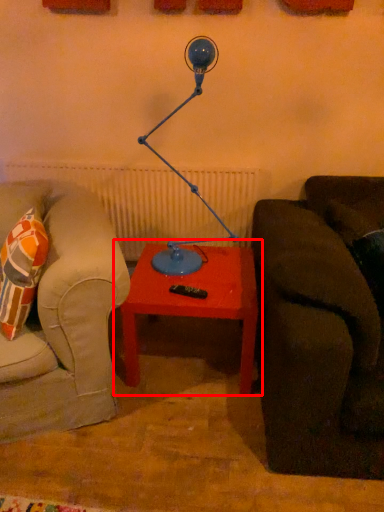
Question: From the image's perspective, considering the relative positions of table (annotated by the red box) and table lamp in the image provided, where is table (annotated by the red box) located with respect to the staircase?

Choices:
 (A) above
 (B) below

Answer: (B)